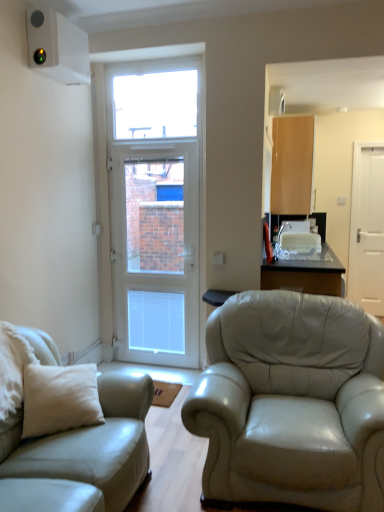
Question: Does white glossy door at center, the first door in the left-to-right sequence, have a greater height compared to light beige leather couch at left?

Choices:
 (A) yes
 (B) no

Answer: (A)

Question: From the image's perspective, would you say white glossy door at center, the first door in the left-to-right sequence, is shown under light beige leather couch at left?

Choices:
 (A) yes
 (B) no

Answer: (B)

Question: Considering the relative sizes of white glossy door at center, the 2th door in the back-to-front sequence, and light beige leather couch at left in the image provided, is white glossy door at center, the 2th door in the back-to-front sequence, bigger than light beige leather couch at left?

Choices:
 (A) no
 (B) yes

Answer: (A)

Question: Is white glossy door at center, the 2th door in the back-to-front sequence, positioned behind light beige leather couch at left?

Choices:
 (A) yes
 (B) no

Answer: (A)

Question: From a real-world perspective, is white glossy door at center, the 2th door in the back-to-front sequence, physically below light beige leather couch at left?

Choices:
 (A) no
 (B) yes

Answer: (A)

Question: Would you say light brown wood cabinet at upper right is inside or outside transparent glass table at center?

Choices:
 (A) inside
 (B) outside

Answer: (B)

Question: From their relative heights in the image, would you say light brown wood cabinet at upper right is taller or shorter than transparent glass table at center?

Choices:
 (A) short
 (B) tall

Answer: (B)

Question: Is point (297, 141) positioned closer to the camera than point (302, 258)?

Choices:
 (A) closer
 (B) farther

Answer: (B)

Question: Is light brown wood cabinet at upper right wider or thinner than transparent glass table at center?

Choices:
 (A) wide
 (B) thin

Answer: (B)

Question: Relative to transparent glass window at upper center, is white matte door at right, which is the second door in left-to-right order, in front or behind?

Choices:
 (A) front
 (B) behind

Answer: (B)

Question: In the image, is white matte door at right, the first door positioned from the right, on the left side or the right side of transparent glass window at upper center?

Choices:
 (A) right
 (B) left

Answer: (A)

Question: From a real-world perspective, relative to transparent glass window at upper center, is white matte door at right, which appears as the first door when viewed from the back, vertically above or below?

Choices:
 (A) above
 (B) below

Answer: (B)

Question: From the image's perspective, is white matte door at right, the first door positioned from the right, positioned above or below transparent glass window at upper center?

Choices:
 (A) above
 (B) below

Answer: (B)

Question: From a real-world perspective, is transparent glass table at center physically located above or below light brown wood cabinet at upper right?

Choices:
 (A) below
 (B) above

Answer: (A)

Question: From the image's perspective, is transparent glass table at center above or below light brown wood cabinet at upper right?

Choices:
 (A) below
 (B) above

Answer: (A)